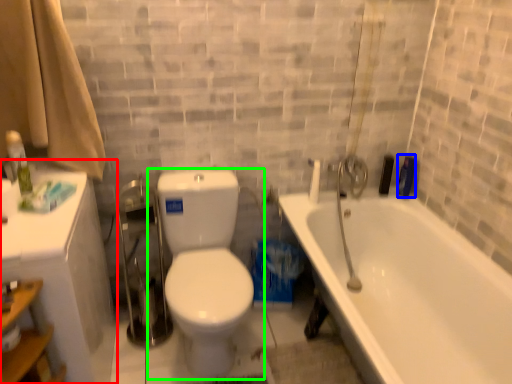
Question: Considering the real-world distances, which object is farthest from medicine cabinet (highlighted by a red box)? toiletry (highlighted by a blue box) or toilet (highlighted by a green box)?

Choices:
 (A) toiletry
 (B) toilet

Answer: (A)